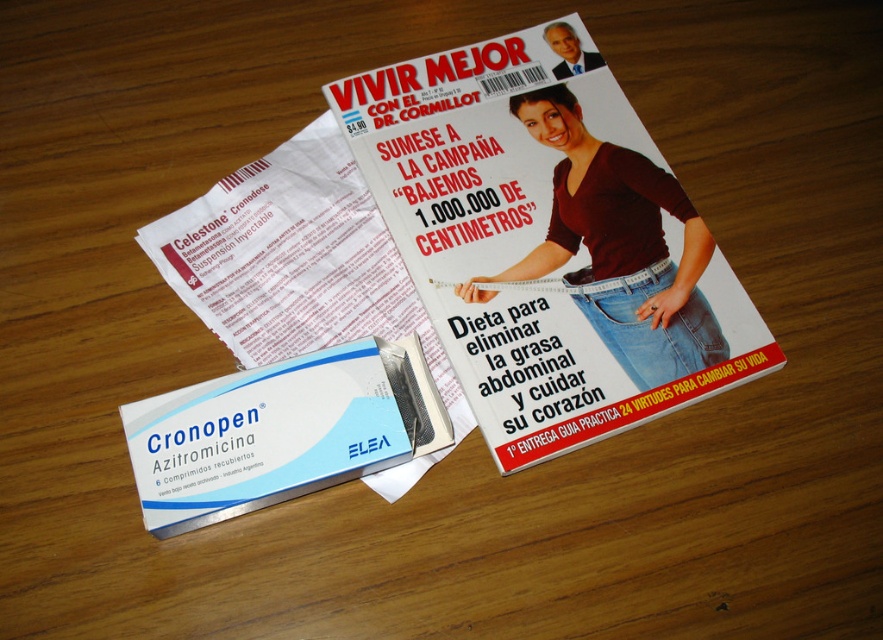
Between point (389, 131) and point (186, 301), which one is positioned in front?

Point (186, 301) is in front.

The image size is (883, 640). What do you see at coordinates (547, 240) in the screenshot? I see `matte paper magazine at center` at bounding box center [547, 240].

The image size is (883, 640). What are the coordinates of `matte paper magazine at center` in the screenshot? It's located at (547, 240).

The image size is (883, 640). What are the coordinates of `matte paper magazine at center` in the screenshot? It's located at (547, 240).

Who is higher up, matte paper magazine at center or jeans at center?

matte paper magazine at center is higher up.

Who is positioned more to the right, matte paper magazine at center or jeans at center?

From the viewer's perspective, jeans at center appears more on the right side.

Between point (608, 416) and point (659, 298), which one is positioned behind?

The point (659, 298) is more distant.

This screenshot has width=883, height=640. I want to click on matte paper magazine at center, so click(x=547, y=240).

Between white paper at center and jeans at center, which one has more height?

white paper at center is taller.

Does white paper at center have a greater width compared to jeans at center?

Correct, the width of white paper at center exceeds that of jeans at center.

Between point (220, 186) and point (644, 388), which one is positioned behind?

Point (220, 186)

This screenshot has width=883, height=640. Identify the location of white paper at center. (295, 260).